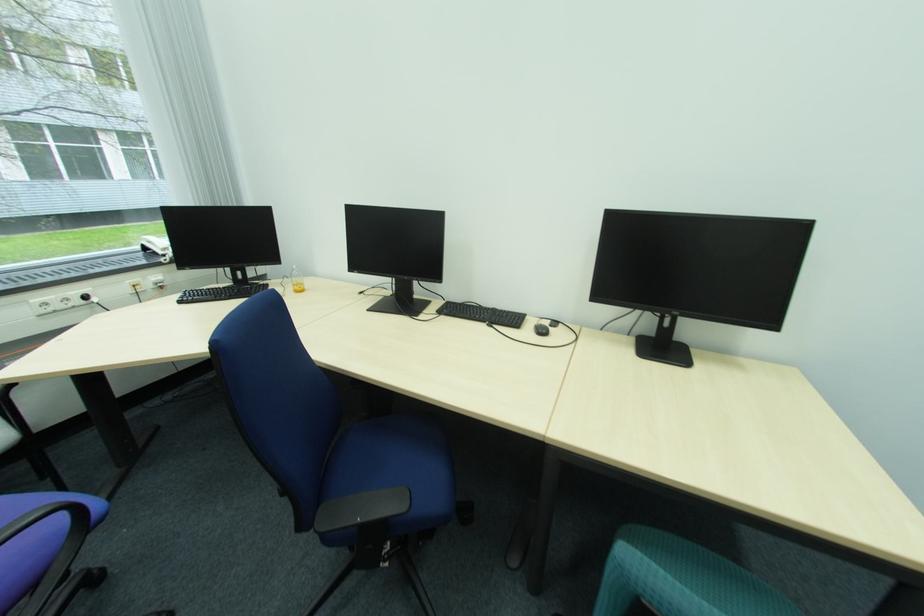
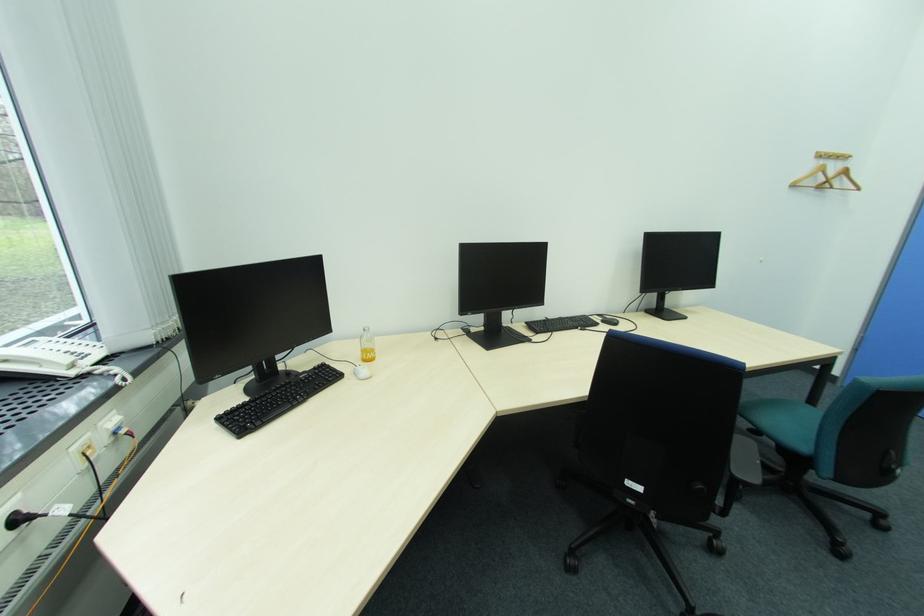
In the second image, find the point that corresponds to [92,299] in the first image.

(26, 521)